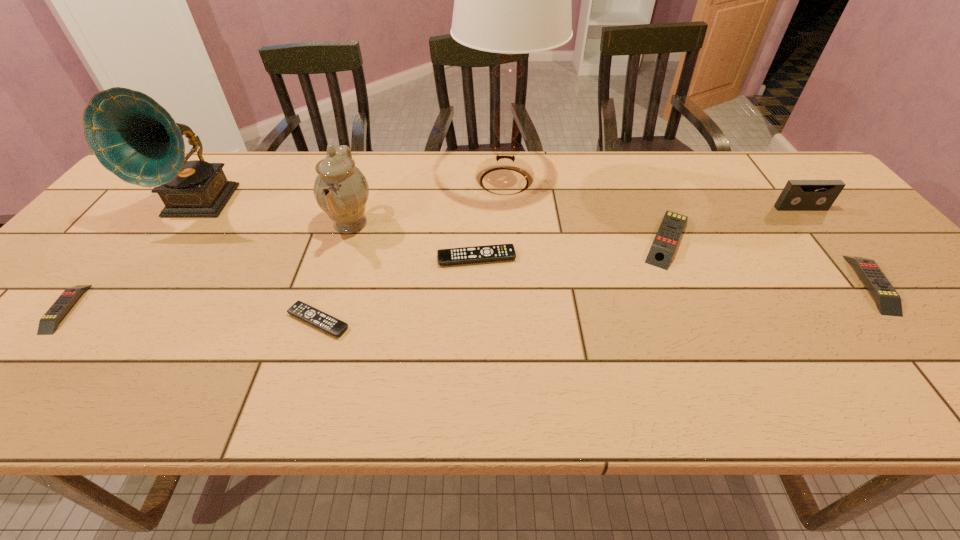
What are the coordinates of `the bigger black remote control` in the screenshot? It's located at (499, 252).

You are a GUI agent. You are given a task and a screenshot of the screen. Output one action in this format:
    pyautogui.click(x=<x>, y=<y>)
    Task: Click on the right black remote control
    This screenshot has height=540, width=960.
    Given the screenshot: What is the action you would take?
    pyautogui.click(x=499, y=252)

Where is `the nearer black remote control`? Image resolution: width=960 pixels, height=540 pixels. the nearer black remote control is located at coordinates (303, 311).

You are a GUI agent. You are given a task and a screenshot of the screen. Output one action in this format:
    pyautogui.click(x=<x>, y=<y>)
    Task: Click on the smaller black remote control
    This screenshot has height=540, width=960.
    Given the screenshot: What is the action you would take?
    pyautogui.click(x=303, y=311)

Locate an element on the screen. The image size is (960, 540). vacant space located on the front-facing side of the tallest object is located at coordinates (420, 181).

Locate an element on the screen. The image size is (960, 540). vacant space located on the front-facing side of the tallest object is located at coordinates (373, 181).

You are a GUI agent. You are given a task and a screenshot of the screen. Output one action in this format:
    pyautogui.click(x=<x>, y=<y>)
    Task: Click on the vacant space located on the front-facing side of the tallest object
    
    Given the screenshot: What is the action you would take?
    pyautogui.click(x=337, y=181)

Identify the location of vacant space positioned 0.180m from the horn of the second tallest object. (141, 283).

What are the coordinates of `free space located 0.180m on the spout of the chinaware` in the screenshot? It's located at 443,224.

Where is `blank space located on the front-facing side of the videotape`? The image size is (960, 540). blank space located on the front-facing side of the videotape is located at coordinates (861, 281).